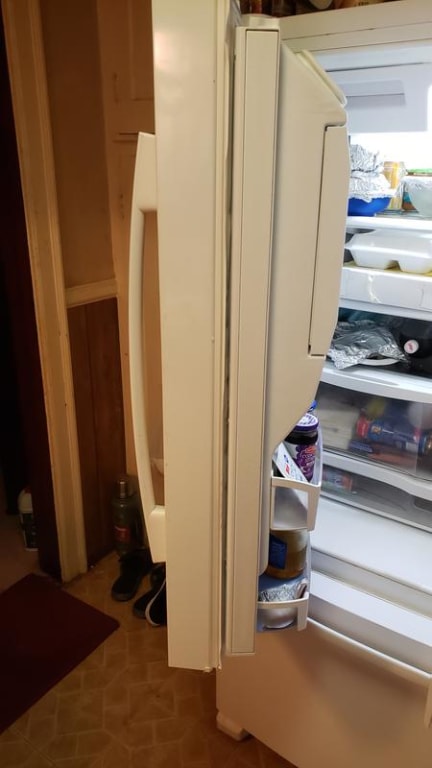
Find the location of a particular element. The width and height of the screenshot is (432, 768). floor is located at coordinates (94, 742), (131, 694), (168, 730), (72, 716), (126, 650), (187, 703), (206, 747).